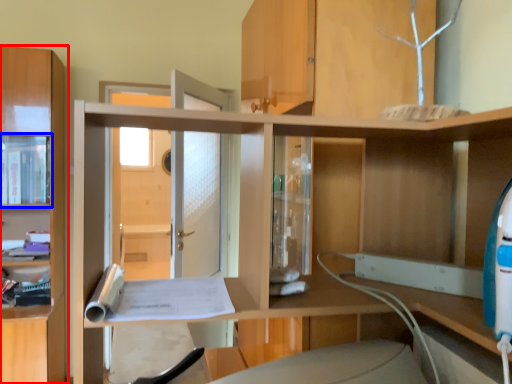
Question: Among these objects, which one is nearest to the camera, cabinetry (highlighted by a red box) or cabinet (highlighted by a blue box)?

Choices:
 (A) cabinetry
 (B) cabinet

Answer: (A)